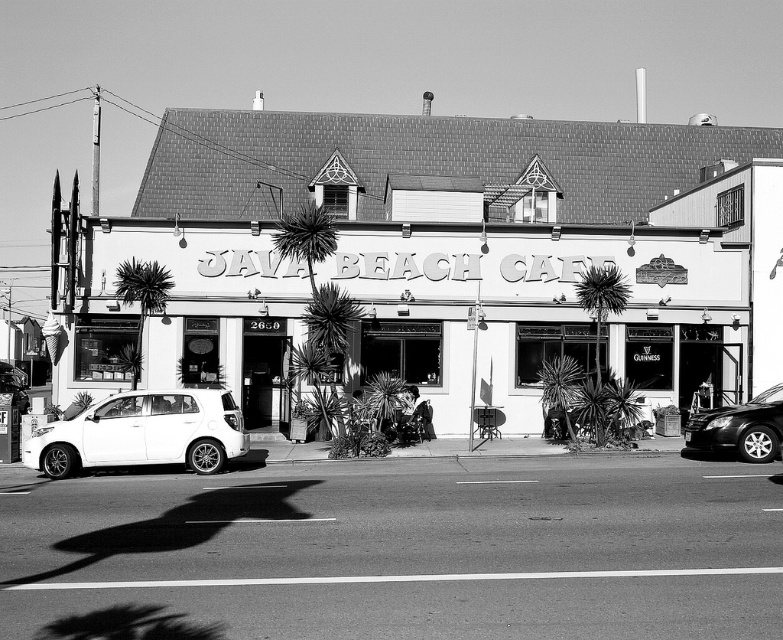
You are standing at the entrance of the JAVA BEACH CAFE and want to park your car. The parking spot is to the left of the dark green leafy palm tree at left. Can the white matte hatchback at lower left currently blocking the entrance move to the parking spot without moving past the palm tree?

The white matte hatchback at lower left is to the right of the dark green leafy palm tree at left, so it can move to the parking spot to the left of the palm tree without moving past it.

You are a delivery person approaching the JAVA BEACH CAFE. You need to determine the best parking spot for your van, which is 6 meters long. The white matte building at center and the dark green leafy palm tree at center are in the way. Which object should you move to make space?

The white matte building at center has a larger size compared to dark green leafy palm tree at center, so you should move the dark green leafy palm tree at center to make space for your van.